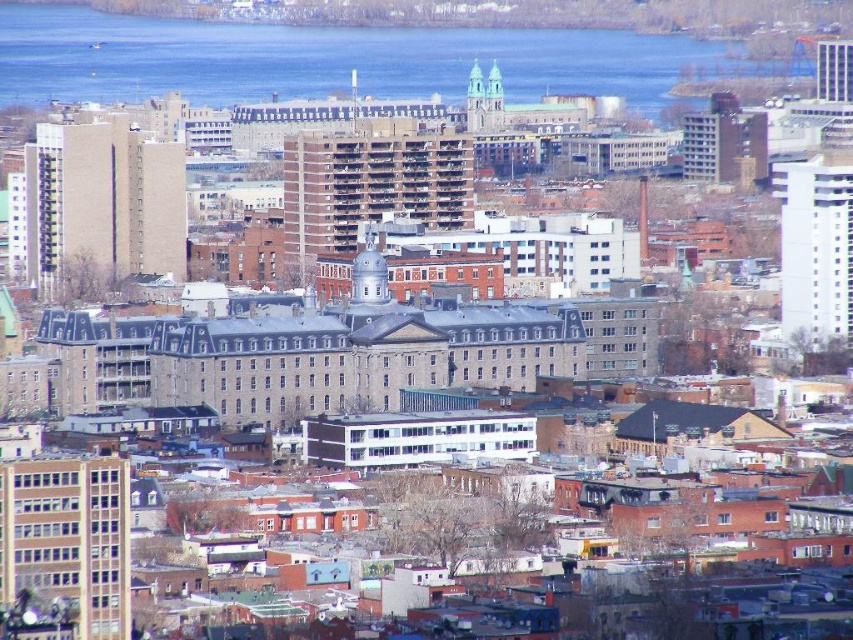
Does point (42, 232) lie in front of point (312, 252)?

No.

Locate an element on the screen. The height and width of the screenshot is (640, 853). matte beige building at left is located at coordinates (102, 205).

Between point (140, 80) and point (300, 182), which one is positioned in front?

Point (300, 182)

Between point (712, 60) and point (430, 138), which one is positioned behind?

The point (712, 60) is more distant.

Find the location of a particular element. The image size is (853, 640). blue water at upper center is located at coordinates (337, 60).

Which is more to the right, blue water at upper center or metallic glass skyscraper at upper right?

From the viewer's perspective, metallic glass skyscraper at upper right appears more on the right side.

Describe the element at coordinates (337, 60) in the screenshot. I see `blue water at upper center` at that location.

Locate an element on the screen. The image size is (853, 640). blue water at upper center is located at coordinates (337, 60).